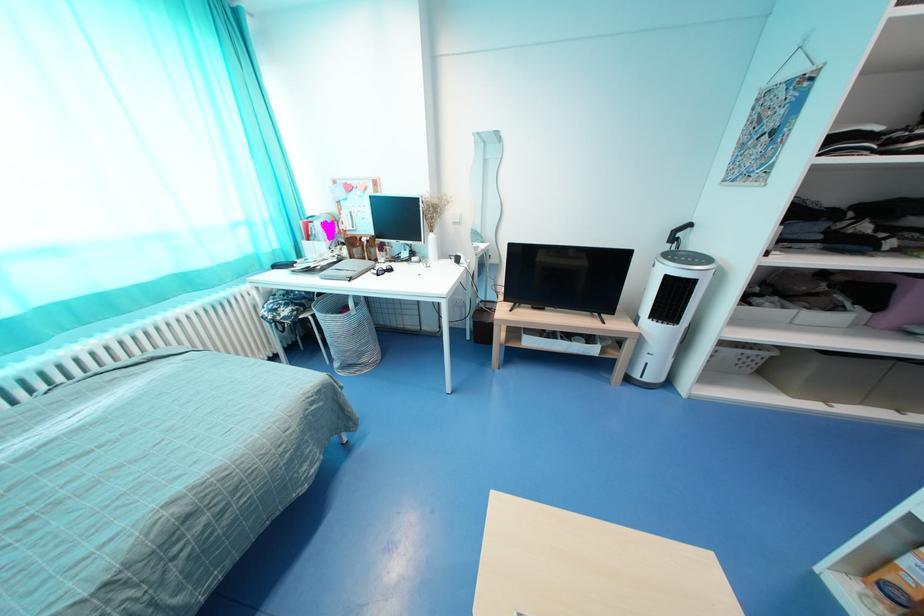
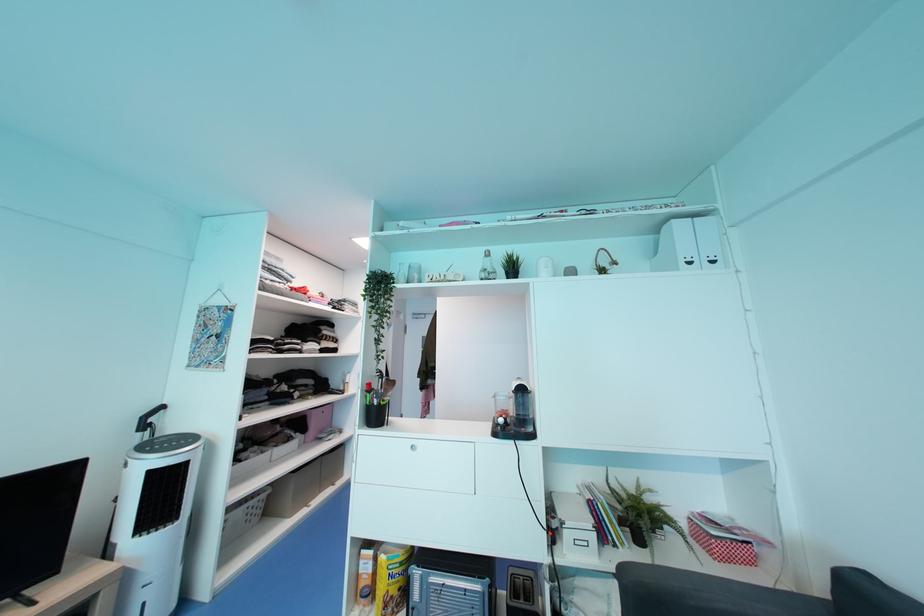
Question: The camera is either moving clockwise (left) or counter-clockwise (right) around the object. The first image is from the beginning of the video and the second image is from the end. Is the camera moving left or right when shooting the video?

Choices:
 (A) Left
 (B) Right

Answer: (A)